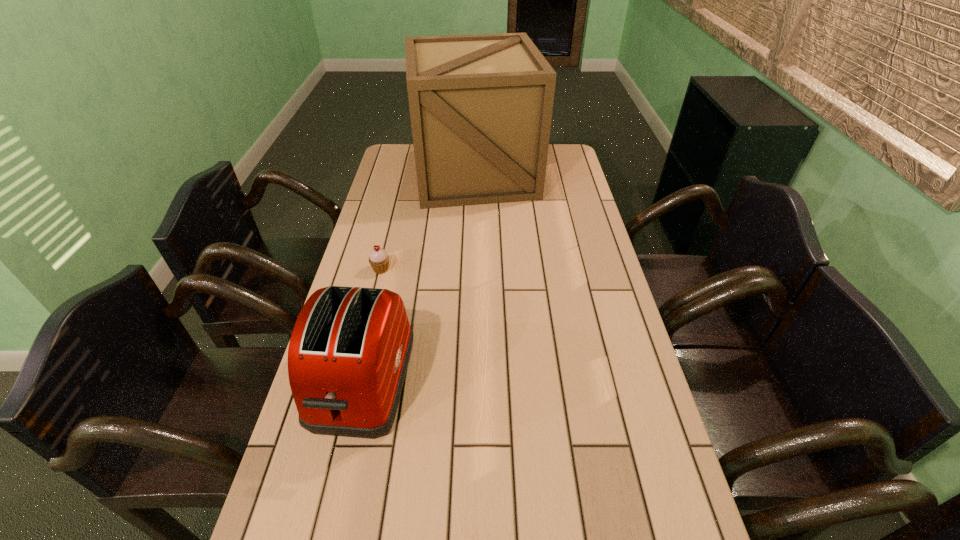
Locate an element on the screen. Image resolution: width=960 pixels, height=540 pixels. vacant space that is in between the second farthest object and the farthest object is located at coordinates (428, 221).

You are a GUI agent. You are given a task and a screenshot of the screen. Output one action in this format:
    pyautogui.click(x=<x>, y=<y>)
    Task: Click on the free space between the box and the nearest object
    Image resolution: width=960 pixels, height=540 pixels.
    Given the screenshot: What is the action you would take?
    pyautogui.click(x=419, y=277)

This screenshot has height=540, width=960. I want to click on vacant space that's between the farthest object and the second shortest object, so click(419, 277).

Find the location of a particular element. free space between the nearest object and the farthest object is located at coordinates (419, 277).

Where is `unoccupied position between the second nearest object and the box`? This screenshot has width=960, height=540. unoccupied position between the second nearest object and the box is located at coordinates (428, 221).

Select which object is the closest to the farthest object. Please provide its 2D coordinates. Your answer should be formatted as a tuple, i.e. [(x, y)], where the tuple contains the x and y coordinates of a point satisfying the conditions above.

[(379, 259)]

Point out which object is positioned as the nearest to the toaster. Please provide its 2D coordinates. Your answer should be formatted as a tuple, i.e. [(x, y)], where the tuple contains the x and y coordinates of a point satisfying the conditions above.

[(379, 259)]

Where is `free space in the image that satisfies the following two spatial constraints: 1. on the front side of the second shortest object; 2. on the right side of the cupcake`? This screenshot has width=960, height=540. free space in the image that satisfies the following two spatial constraints: 1. on the front side of the second shortest object; 2. on the right side of the cupcake is located at coordinates (353, 381).

Identify the location of vacant region that satisfies the following two spatial constraints: 1. on the back side of the second tallest object; 2. on the left side of the tallest object. The height and width of the screenshot is (540, 960). (410, 173).